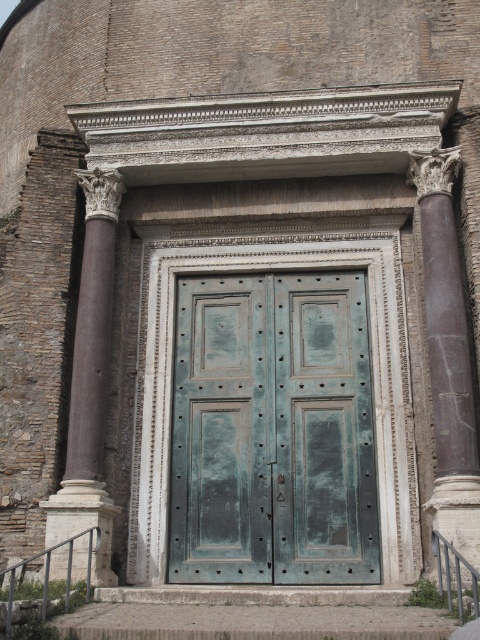
You are an architect examining the entrance of a historic Roman building. You notice two brown marble columns flanking the entrance. Based on their height, which column would require a taller ladder to reach its top? Please refer to the columns labeled as the brown marble column at right and the brown marble column at left in your answer.

The brown marble column at left is taller than the brown marble column at right, so a taller ladder would be needed to reach the top of the brown marble column at left.